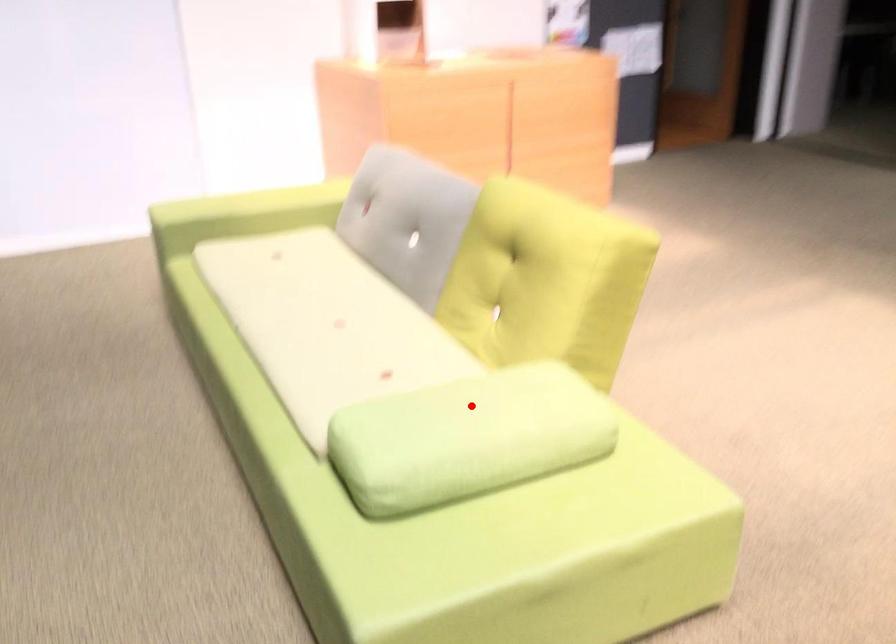
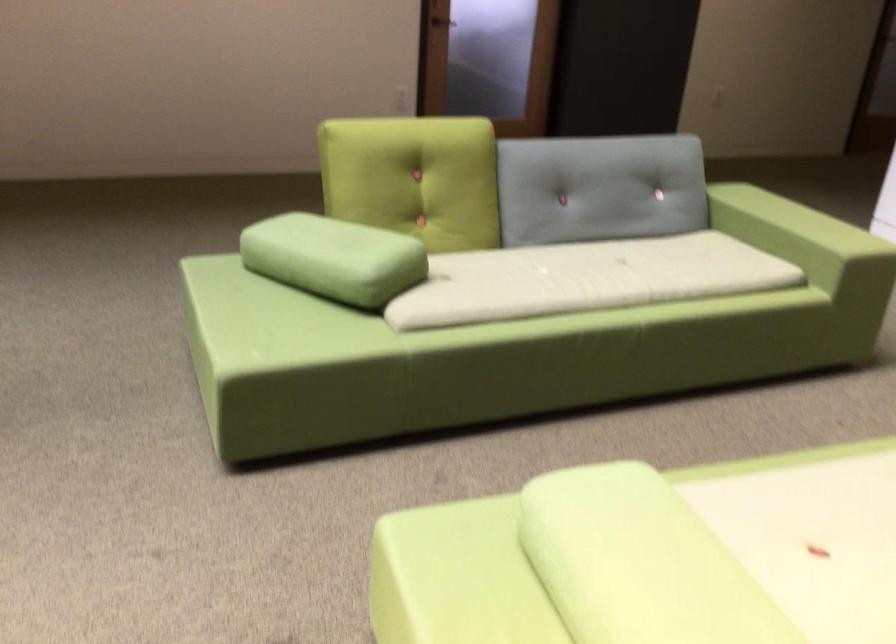
Question: I am providing you with two images of the same scene from different viewpoints. Image1 has a red point marked. In image2, the corresponding 3D location appears at what relative position? Reply with the corresponding letter.

Choices:
 (A) Closer
 (B) Farther

Answer: (A)